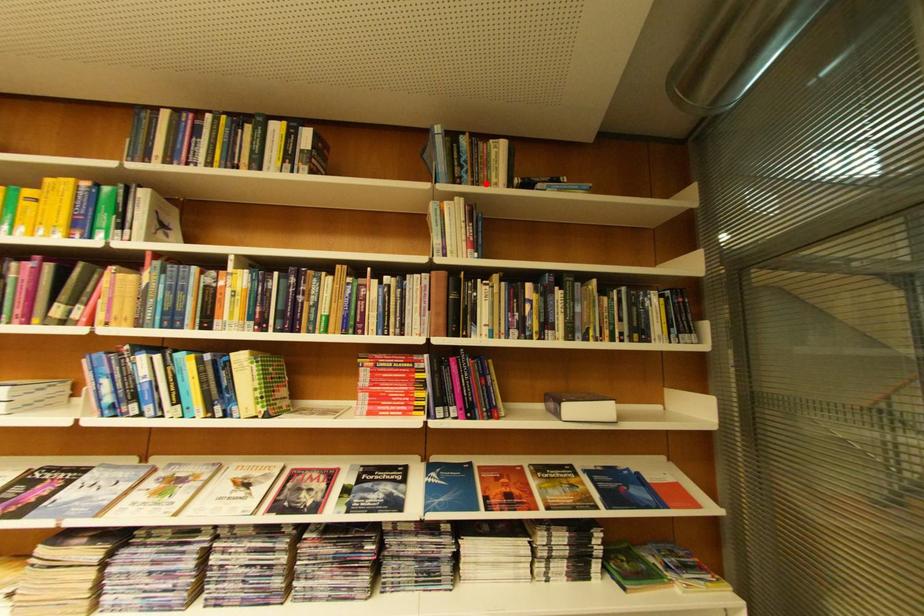
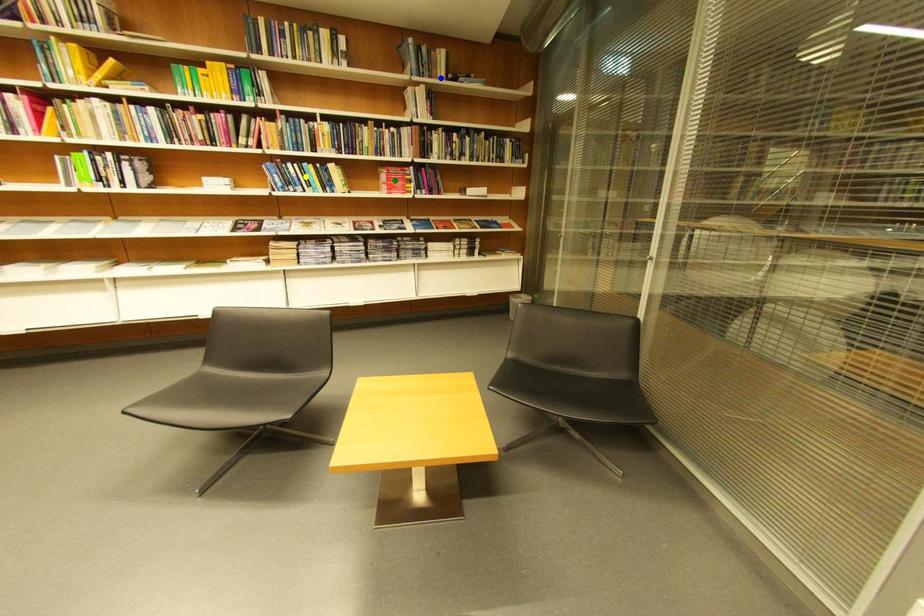
Question: I am providing you with two images of the same scene from different viewpoints. A red point is marked on the first image. You are given multiple points on the second image. Which point in image 2 is actually the same real-world point as the red point in image 1?

Choices:
 (A) yellow point
 (B) blue point
 (C) green point

Answer: (B)